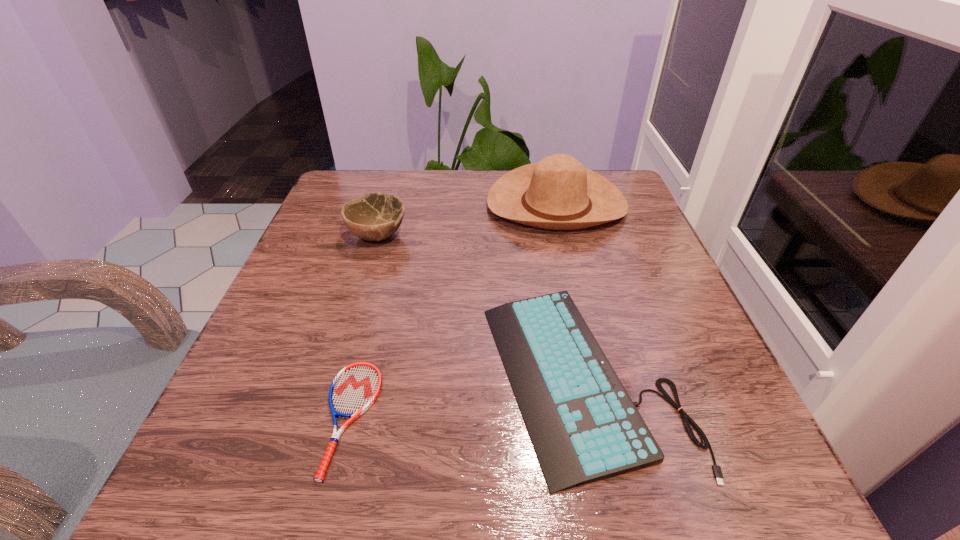
This screenshot has width=960, height=540. In order to click on vacant space at the far edge of the desktop in this screenshot , I will do `click(444, 176)`.

Identify the location of vacant area at the left edge. The height and width of the screenshot is (540, 960). (266, 381).

In the image, there is a desktop. Where is `blank space at the right edge`? This screenshot has height=540, width=960. blank space at the right edge is located at coordinates (603, 317).

Find the location of `free space at the far left corner of the desktop`. free space at the far left corner of the desktop is located at coordinates (366, 188).

Locate an element on the screen. The height and width of the screenshot is (540, 960). free space at the near left corner of the desktop is located at coordinates (278, 496).

Locate an element on the screen. vacant space at the far right corner is located at coordinates (607, 178).

You are a GUI agent. You are given a task and a screenshot of the screen. Output one action in this format:
    pyautogui.click(x=<x>, y=<y>)
    Task: Click on the vacant area that lies between the cowboy hat and the second shortest object
    This screenshot has height=540, width=960.
    Given the screenshot: What is the action you would take?
    pyautogui.click(x=569, y=291)

Where is `vacant space in between the tallest object and the shortest object`? The width and height of the screenshot is (960, 540). vacant space in between the tallest object and the shortest object is located at coordinates (453, 312).

Locate an element on the screen. free space between the tallest object and the bowl is located at coordinates (467, 221).

Locate an element on the screen. This screenshot has height=540, width=960. vacant area between the shortest object and the bowl is located at coordinates point(364,327).